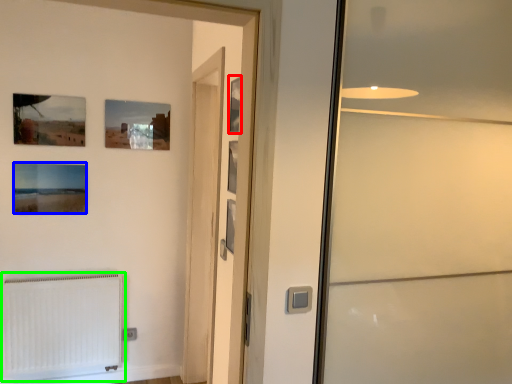
Question: Which is farther away from picture frame (highlighted by a red box)? picture frame (highlighted by a blue box) or radiator (highlighted by a green box)?

Choices:
 (A) picture frame
 (B) radiator

Answer: (B)